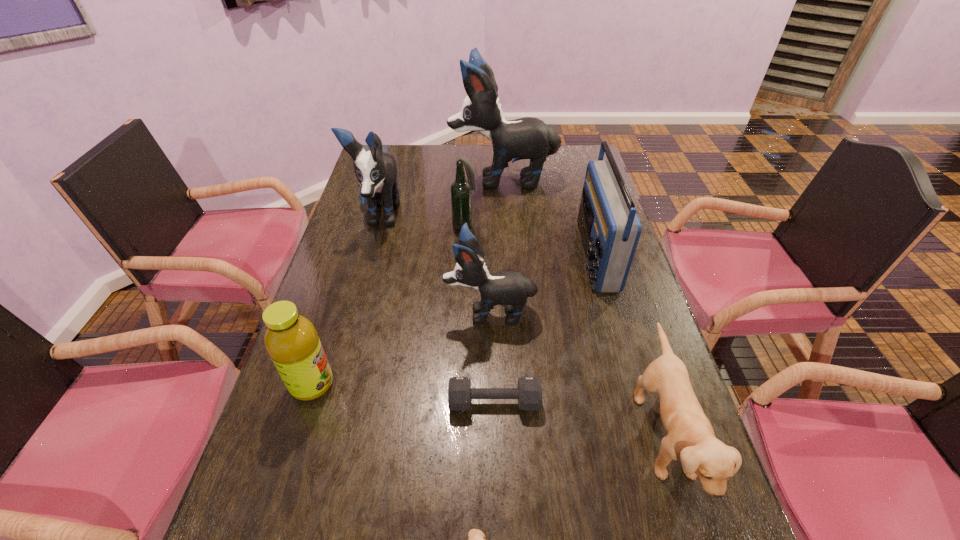
The width and height of the screenshot is (960, 540). In order to click on the tallest puppy in this screenshot , I will do `click(530, 138)`.

Find the location of a particular element. The image size is (960, 540). the tallest object is located at coordinates (530, 138).

Where is `the second smallest black puppy`? the second smallest black puppy is located at coordinates (376, 171).

This screenshot has width=960, height=540. Find the location of `the eighth shortest object`. the eighth shortest object is located at coordinates (376, 171).

The width and height of the screenshot is (960, 540). Identify the location of radio receiver. (610, 229).

At what (x,y) coordinates should I click in order to perform the action: click on the third nearest puppy. Please return your answer as a coordinate pair (x, y). This screenshot has height=540, width=960. Looking at the image, I should click on (510, 288).

Locate an element on the screen. the nearest black puppy is located at coordinates (510, 288).

Where is `beer bottle`? Image resolution: width=960 pixels, height=540 pixels. beer bottle is located at coordinates (461, 189).

Identify the location of fruit juice. (291, 340).

You are a GUI agent. You are given a task and a screenshot of the screen. Output one action in this format:
    pyautogui.click(x=<x>, y=<y>)
    Task: Click on the farther beige puppy
    This screenshot has width=960, height=540.
    Given the screenshot: What is the action you would take?
    pyautogui.click(x=691, y=439)